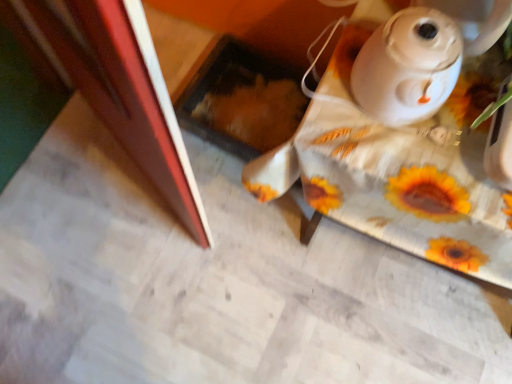
You are a GUI agent. You are given a task and a screenshot of the screen. Output one action in this format:
    pyautogui.click(x=<x>, y=<y>)
    Task: Click on the vacant space to the right of white glossy kettle at upper right
    The width and height of the screenshot is (512, 384).
    Given the screenshot: What is the action you would take?
    pyautogui.click(x=468, y=100)